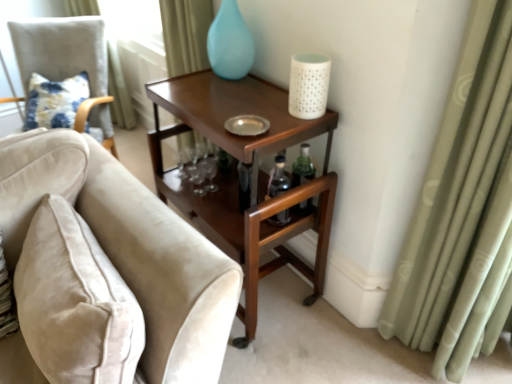
Question: Is mahogany wood side table at upper right placed right next to white textured candle at upper right?

Choices:
 (A) no
 (B) yes

Answer: (A)

Question: Does mahogany wood side table at upper right have a greater width compared to white textured candle at upper right?

Choices:
 (A) no
 (B) yes

Answer: (B)

Question: Is mahogany wood side table at upper right aimed at white textured candle at upper right?

Choices:
 (A) no
 (B) yes

Answer: (A)

Question: Is mahogany wood side table at upper right further to camera compared to white textured candle at upper right?

Choices:
 (A) yes
 (B) no

Answer: (B)

Question: Is mahogany wood side table at upper right at the right side of white textured candle at upper right?

Choices:
 (A) no
 (B) yes

Answer: (A)

Question: Can you confirm if mahogany wood side table at upper right is taller than white textured candle at upper right?

Choices:
 (A) no
 (B) yes

Answer: (B)

Question: Can you confirm if light green fabric curtain at upper left, placed as the first curtain when sorted from back to front, is positioned to the right of matte blue glass vase at upper center?

Choices:
 (A) yes
 (B) no

Answer: (B)

Question: Is light green fabric curtain at upper left, the 1th curtain positioned from the top, placed right next to matte blue glass vase at upper center?

Choices:
 (A) no
 (B) yes

Answer: (A)

Question: Does light green fabric curtain at upper left, the 2th curtain in the bottom-to-top sequence, have a greater height compared to matte blue glass vase at upper center?

Choices:
 (A) yes
 (B) no

Answer: (A)

Question: Is light green fabric curtain at upper left, the 2th curtain in the bottom-to-top sequence, far away from matte blue glass vase at upper center?

Choices:
 (A) yes
 (B) no

Answer: (B)

Question: Considering the relative sizes of light green fabric curtain at upper left, the 1th curtain positioned from the top, and matte blue glass vase at upper center in the image provided, is light green fabric curtain at upper left, the 1th curtain positioned from the top, thinner than matte blue glass vase at upper center?

Choices:
 (A) yes
 (B) no

Answer: (B)

Question: Is the depth of light green fabric curtain at upper left, arranged as the second curtain when viewed from the right, greater than that of matte blue glass vase at upper center?

Choices:
 (A) yes
 (B) no

Answer: (A)

Question: From the image's perspective, is velvet beige sofa at left, marked as the 1th chair in a right-to-left arrangement, above matte blue glass vase at upper center?

Choices:
 (A) no
 (B) yes

Answer: (A)